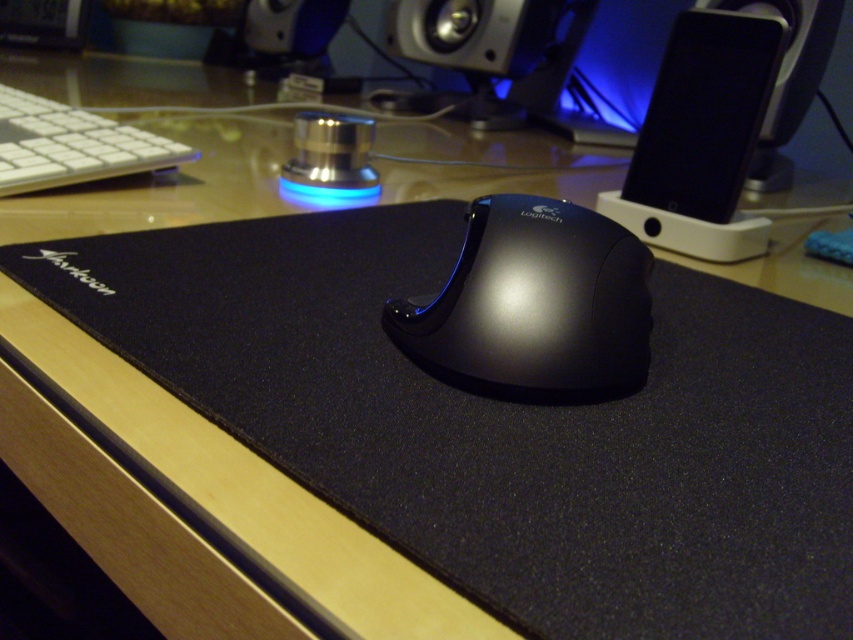
Question: Among these points, which one is farthest from the camera?

Choices:
 (A) (503, 209)
 (B) (9, 93)
 (C) (786, 156)

Answer: (C)

Question: Is white matte keyboard at upper left to the right of metallic silver speaker at upper center from the viewer's perspective?

Choices:
 (A) no
 (B) yes

Answer: (A)

Question: Can you confirm if white matte keyboard at upper left is positioned to the right of metallic silver speaker at upper center?

Choices:
 (A) yes
 (B) no

Answer: (B)

Question: Estimate the real-world distances between objects in this image. Which object is closer to the black glossy mouse at center?

Choices:
 (A) black plastic speaker at upper center
 (B) black glossy speaker at upper right

Answer: (B)

Question: Which point appears farthest from the camera in this image?

Choices:
 (A) (171, 163)
 (B) (511, 205)
 (C) (787, 124)

Answer: (C)

Question: Does white matte keyboard at upper left have a larger size compared to black plastic speaker at upper center?

Choices:
 (A) yes
 (B) no

Answer: (A)